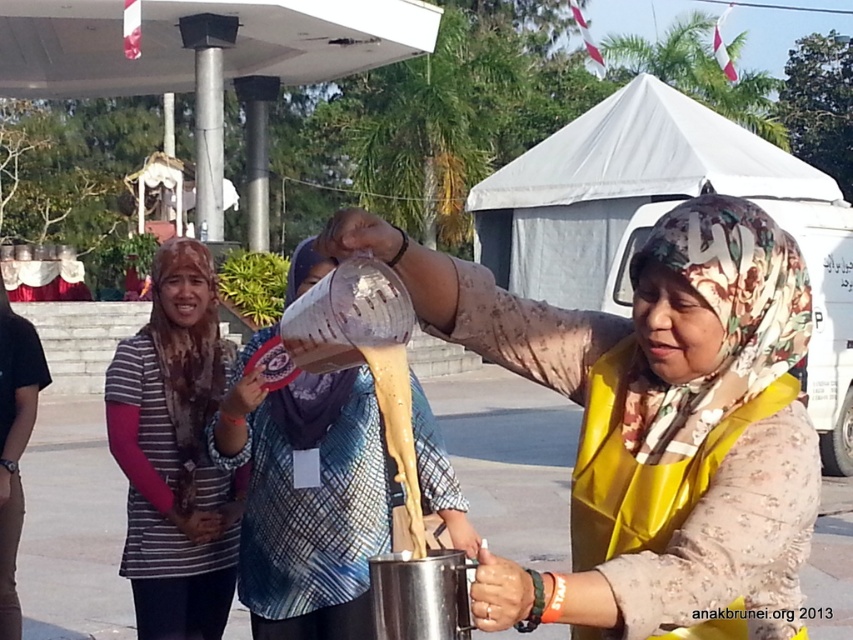
You are a chef standing in front of the scene and want to grab the matte plastic container at center to take a sample of the liquid. Can you reach it without moving the matte yellow apron at center?

The matte yellow apron at center is closer to the viewer than the matte plastic container at center, so you cannot reach the matte plastic container at center without moving the matte yellow apron at center first.

You are a chef observing the scene. You see the matte yellow apron at center and the matte plastic container at center. Which object is located to the right of the other?

The matte yellow apron at center is positioned on the right side of the matte plastic container at center, so the matte yellow apron at center is to the right of the matte plastic container at center.

You are a photographer standing at the edge of the scene. You want to take a photo of the matte yellow apron at center and the striped fabric headscarf at center so that both are clearly visible in the frame. Given their distance apart, is it possible to capture both in a single shot without zooming in?

The matte yellow apron at center and the striped fabric headscarf at center are 2.09 meters apart. Since the photographer is at the edge of the scene and not zooming in, it should be possible to capture both in a single shot as they are within a reasonable distance for a standard camera lens.